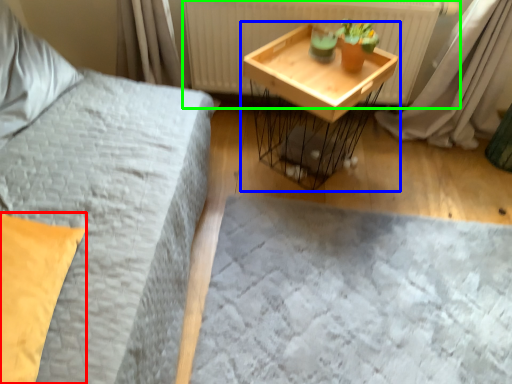
Question: Considering the real-world distances, which object is farthest from pillow (highlighted by a red box)? table (highlighted by a blue box) or radiator (highlighted by a green box)?

Choices:
 (A) table
 (B) radiator

Answer: (B)